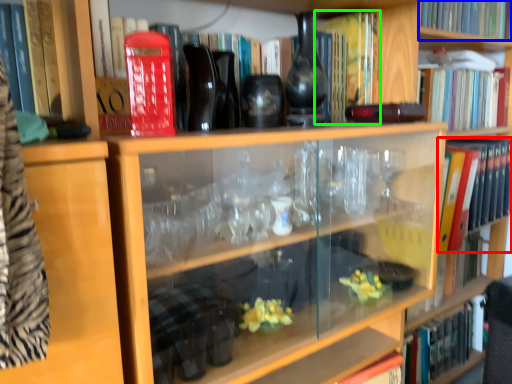
Question: Which is farther away from book (highlighted by a red box)? book (highlighted by a blue box) or book (highlighted by a green box)?

Choices:
 (A) book
 (B) book

Answer: (B)